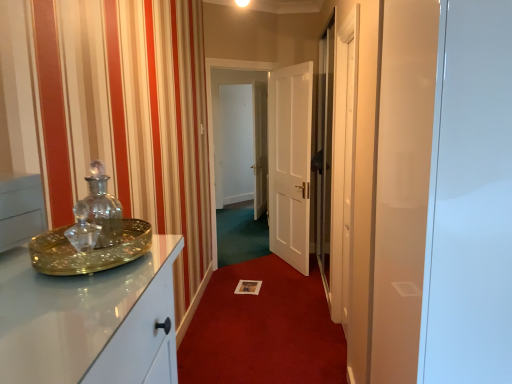
Where is `free space in front of white wooden door at center`? free space in front of white wooden door at center is located at coordinates (284, 277).